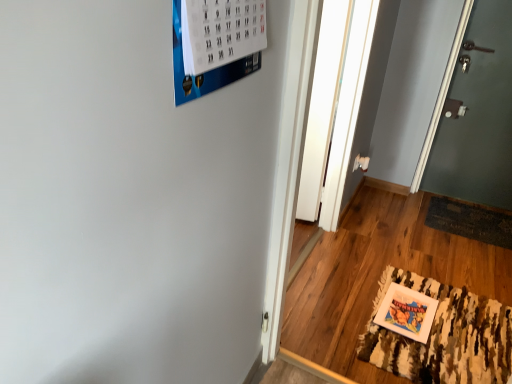
The image size is (512, 384). Find the location of `vacant space that is in between dark brown woven mat at lower right and camouflage-patterned rug at lower right`. vacant space that is in between dark brown woven mat at lower right and camouflage-patterned rug at lower right is located at coordinates (453, 253).